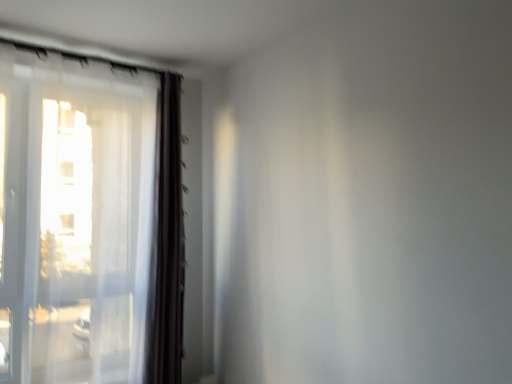
Question: Considering the positions of transparent plastic screen door at left and transparent fabric window at left in the image, is transparent plastic screen door at left bigger or smaller than transparent fabric window at left?

Choices:
 (A) small
 (B) big

Answer: (A)

Question: Choose the correct answer: Is transparent plastic screen door at left inside transparent fabric window at left or outside it?

Choices:
 (A) outside
 (B) inside

Answer: (A)

Question: Which object is the closest to the transparent plastic screen door at left?

Choices:
 (A) dark brown fabric curtain at left
 (B) transparent fabric window at left

Answer: (B)

Question: Which object is the farthest from the transparent fabric window at left?

Choices:
 (A) dark brown fabric curtain at left
 (B) transparent plastic screen door at left

Answer: (B)